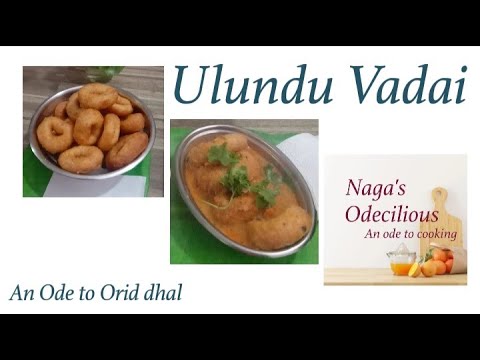
Where is `table`? table is located at coordinates (143, 83).